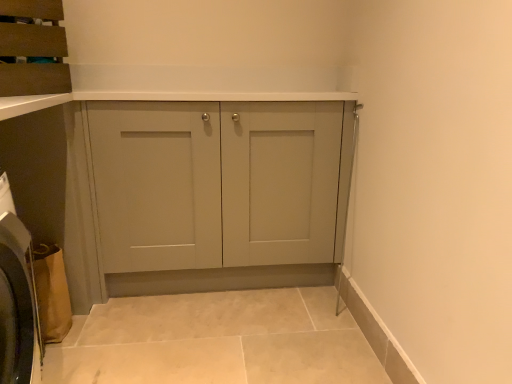
Question: In terms of width, does brown fabric washing machine at lower left look wider or thinner when compared to matte brown cabinet at upper left?

Choices:
 (A) thin
 (B) wide

Answer: (A)

Question: Is point (2, 380) closer or farther from the camera than point (20, 104)?

Choices:
 (A) farther
 (B) closer

Answer: (B)

Question: Which is farther from the matte brown cabinet at upper left?

Choices:
 (A) matte gray cabinet at center
 (B) brown fabric washing machine at lower left

Answer: (A)

Question: Estimate the real-world distances between objects in this image. Which object is closer to the brown fabric washing machine at lower left?

Choices:
 (A) matte brown cabinet at upper left
 (B) matte gray cabinet at center

Answer: (A)